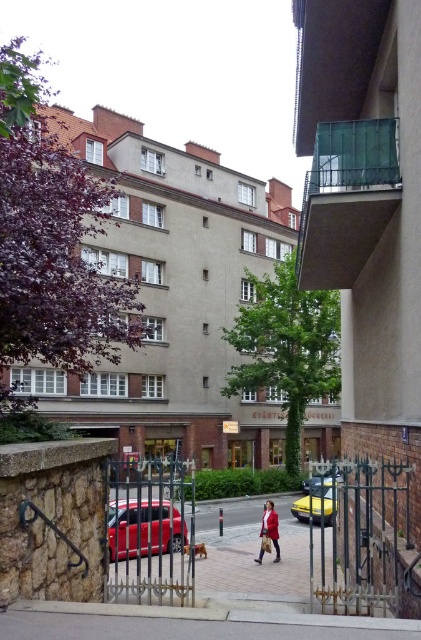
Can you confirm if paved concrete pavement at center is wider than matte red coat at center?

Correct, the width of paved concrete pavement at center exceeds that of matte red coat at center.

Is paved concrete pavement at center bigger than matte red coat at center?

Correct, paved concrete pavement at center is larger in size than matte red coat at center.

This screenshot has width=421, height=640. In order to click on paved concrete pavement at center in this screenshot , I will do tap(183, 627).

I want to click on paved concrete pavement at center, so click(183, 627).

Can you confirm if paved stone pavement at center is positioned above matte red coat at center?

Actually, paved stone pavement at center is below matte red coat at center.

Can you confirm if paved stone pavement at center is wider than matte red coat at center?

Indeed, paved stone pavement at center has a greater width compared to matte red coat at center.

Does point (330, 536) lie behind point (268, 512)?

Yes.

At what (x,y) coordinates should I click in order to perform the action: click on paved stone pavement at center. Please return your answer as a coordinate pair (x, y). Looking at the image, I should click on (252, 554).

Who is positioned more to the right, paved stone pavement at center or shiny red car at center?

Positioned to the right is paved stone pavement at center.

Where is `paved stone pavement at center`? The height and width of the screenshot is (640, 421). paved stone pavement at center is located at coordinates (252, 554).